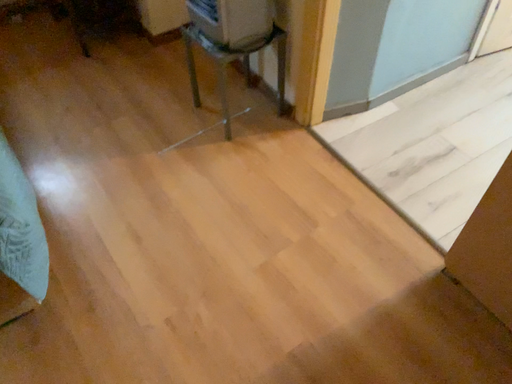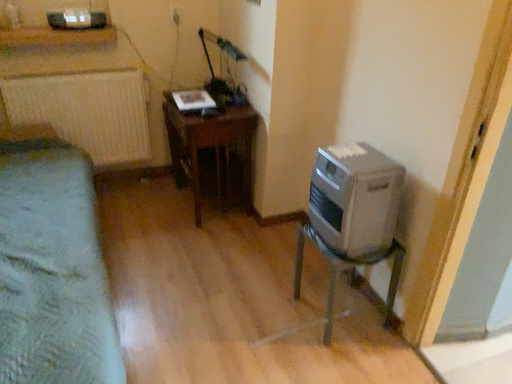
Question: How did the camera likely rotate when shooting the video?

Choices:
 (A) rotated right
 (B) rotated left

Answer: (B)